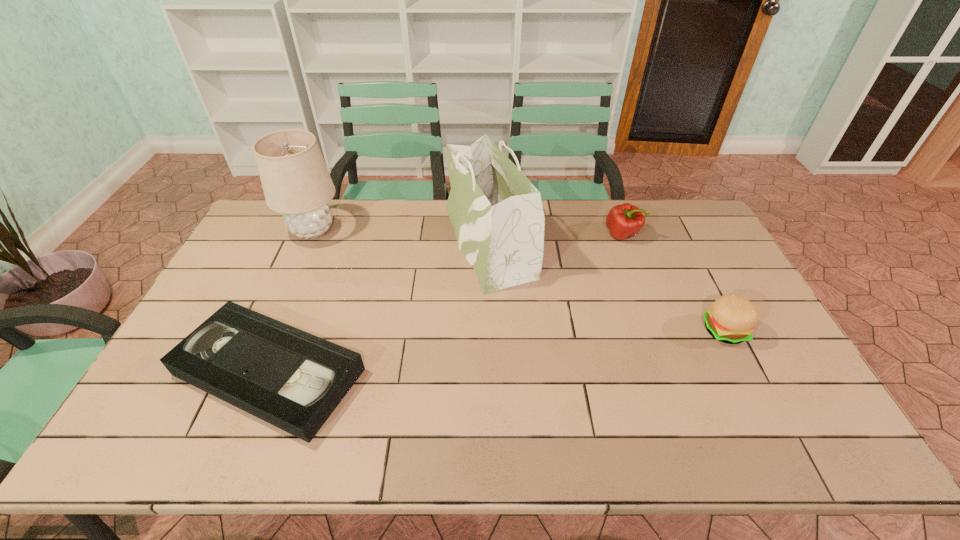
The height and width of the screenshot is (540, 960). What are the coordinates of `grocery bag situated at the far edge` in the screenshot? It's located at (504, 242).

At what (x,y) coordinates should I click in order to perform the action: click on lampshade present at the far edge. Please return your answer as a coordinate pair (x, y). Looking at the image, I should click on (296, 182).

Where is `bell pepper present at the far edge`? This screenshot has height=540, width=960. bell pepper present at the far edge is located at coordinates (624, 221).

The image size is (960, 540). Find the location of `object located in the near edge section of the desktop`. object located in the near edge section of the desktop is located at coordinates (289, 378).

Where is `lampshade that is at the left edge`? The width and height of the screenshot is (960, 540). lampshade that is at the left edge is located at coordinates (296, 182).

Where is `videotape that is at the left edge`? videotape that is at the left edge is located at coordinates point(289,378).

Where is `object that is positioned at the right edge`? The height and width of the screenshot is (540, 960). object that is positioned at the right edge is located at coordinates (731, 319).

Find the location of a particular element. This screenshot has width=960, height=540. object at the far left corner is located at coordinates (296, 182).

You are a GUI agent. You are given a task and a screenshot of the screen. Output one action in this format:
    pyautogui.click(x=<x>, y=<y>)
    Task: Click on the object that is at the near left corner
    
    Given the screenshot: What is the action you would take?
    pyautogui.click(x=289, y=378)

In order to click on vacant space at the far edge of the desktop in this screenshot , I will do `click(455, 237)`.